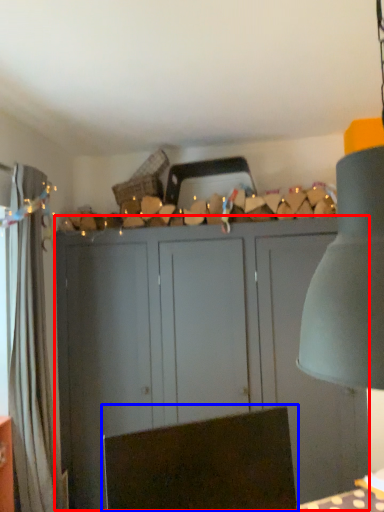
Question: Which object is closer to the camera taking this photo, cupboard (highlighted by a red box) or swivel chair (highlighted by a blue box)?

Choices:
 (A) cupboard
 (B) swivel chair

Answer: (B)